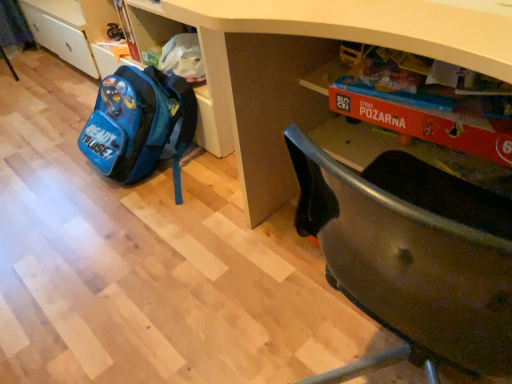
Describe the element at coordinates (139, 124) in the screenshot. The width and height of the screenshot is (512, 384). I see `blue fabric backpack at lower left` at that location.

Measure the distance between blue fabric backpack at lower left and camera.

The distance of blue fabric backpack at lower left from camera is 1.47 meters.

At what (x,y) coordinates should I click in order to perform the action: click on blue fabric backpack at lower left. Please return your answer as a coordinate pair (x, y). Image resolution: width=512 pixels, height=384 pixels. Looking at the image, I should click on (139, 124).

Image resolution: width=512 pixels, height=384 pixels. Identify the location of white matte desk at center. (326, 63).

What do you see at coordinates (326, 63) in the screenshot? The height and width of the screenshot is (384, 512). I see `white matte desk at center` at bounding box center [326, 63].

Identify the location of blue fabric backpack at lower left. Image resolution: width=512 pixels, height=384 pixels. (139, 124).

Does white matte desk at center appear on the right side of blue fabric backpack at lower left?

Indeed, white matte desk at center is positioned on the right side of blue fabric backpack at lower left.

Which object is further away from the camera taking this photo, white matte desk at center or blue fabric backpack at lower left?

blue fabric backpack at lower left is further away from the camera.

Is point (495, 34) closer or farther from the camera than point (110, 122)?

Point (495, 34).

From the image's perspective, would you say white matte desk at center is positioned over blue fabric backpack at lower left?

No.

From a real-world perspective, who is located lower, white matte desk at center or blue fabric backpack at lower left?

blue fabric backpack at lower left.

Based on the photo, which of these two, white matte desk at center or blue fabric backpack at lower left, is wider?

Wider between the two is white matte desk at center.

In terms of height, does white matte desk at center look taller or shorter compared to blue fabric backpack at lower left?

In the image, white matte desk at center appears to be taller than blue fabric backpack at lower left.

Considering the sizes of objects white matte desk at center and blue fabric backpack at lower left in the image provided, who is bigger, white matte desk at center or blue fabric backpack at lower left?

Bigger between the two is white matte desk at center.

Is blue fabric backpack at lower left inside white matte desk at center?

No, blue fabric backpack at lower left is not surrounded by white matte desk at center.

Are white matte desk at center and blue fabric backpack at lower left beside each other?

white matte desk at center is not next to blue fabric backpack at lower left, and they're not touching.

Is white matte desk at center facing towards blue fabric backpack at lower left?

No, white matte desk at center is not turned towards blue fabric backpack at lower left.

Can you tell me how much white matte desk at center and blue fabric backpack at lower left differ in facing direction?

The facing directions of white matte desk at center and blue fabric backpack at lower left are 179 degrees apart.

This screenshot has height=384, width=512. Find the location of `desk positioned vertically above the blue fabric backpack at lower left (from a real-world perspective)`. desk positioned vertically above the blue fabric backpack at lower left (from a real-world perspective) is located at coordinates (326, 63).

Is blue fabric backpack at lower left at the left side of white matte desk at center?

Yes.

Does blue fabric backpack at lower left come in front of white matte desk at center?

No.

Does point (110, 148) lie behind point (478, 34)?

Yes.

From the image's perspective, is blue fabric backpack at lower left located above white matte desk at center?

Correct, blue fabric backpack at lower left appears higher than white matte desk at center in the image.

From a real-world perspective, is blue fabric backpack at lower left above or below white matte desk at center?

blue fabric backpack at lower left is situated lower than white matte desk at center in the real world.

Does blue fabric backpack at lower left have a lesser width compared to white matte desk at center?

Correct, the width of blue fabric backpack at lower left is less than that of white matte desk at center.

From their relative heights in the image, would you say blue fabric backpack at lower left is taller or shorter than white matte desk at center?

blue fabric backpack at lower left is shorter than white matte desk at center.

Is blue fabric backpack at lower left bigger or smaller than white matte desk at center?

In the image, blue fabric backpack at lower left appears to be smaller than white matte desk at center.

Based on the photo, would you say blue fabric backpack at lower left is inside or outside white matte desk at center?

blue fabric backpack at lower left is not inside white matte desk at center, it's outside.

Is blue fabric backpack at lower left far from white matte desk at center?

They are positioned close to each other.

Is blue fabric backpack at lower left facing away from white matte desk at center?

That's not correct — blue fabric backpack at lower left is not looking away from white matte desk at center.

How distant is blue fabric backpack at lower left from white matte desk at center?

The distance of blue fabric backpack at lower left from white matte desk at center is 57.35 centimeters.

At what (x,y) coordinates should I click in order to perform the action: click on desk on the right of blue fabric backpack at lower left. Please return your answer as a coordinate pair (x, y). Looking at the image, I should click on (326, 63).

Where is `desk on the right of blue fabric backpack at lower left`? This screenshot has width=512, height=384. desk on the right of blue fabric backpack at lower left is located at coordinates (326, 63).

At what (x,y) coordinates should I click in order to perform the action: click on backpack below the white matte desk at center (from a real-world perspective). Please return your answer as a coordinate pair (x, y). This screenshot has height=384, width=512. Looking at the image, I should click on (139, 124).